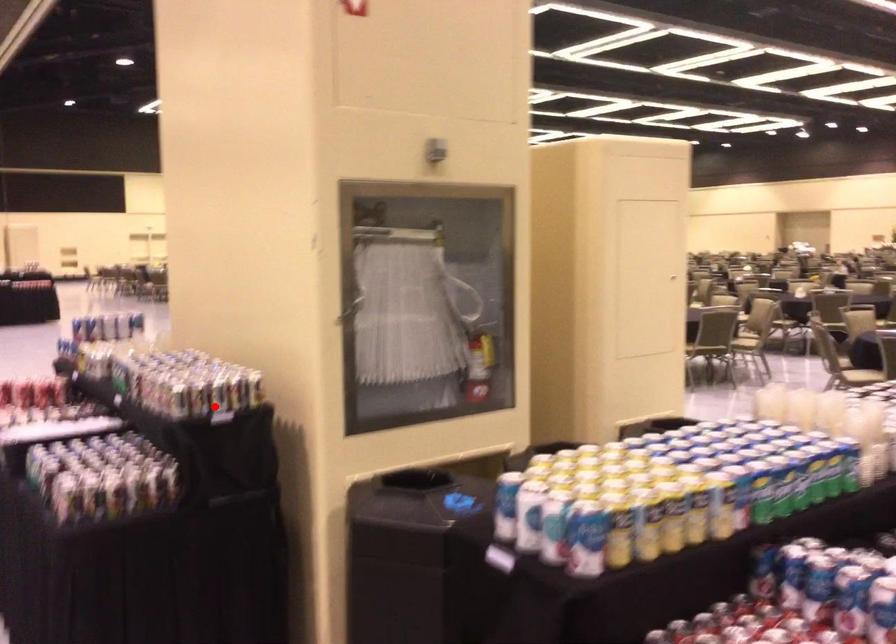
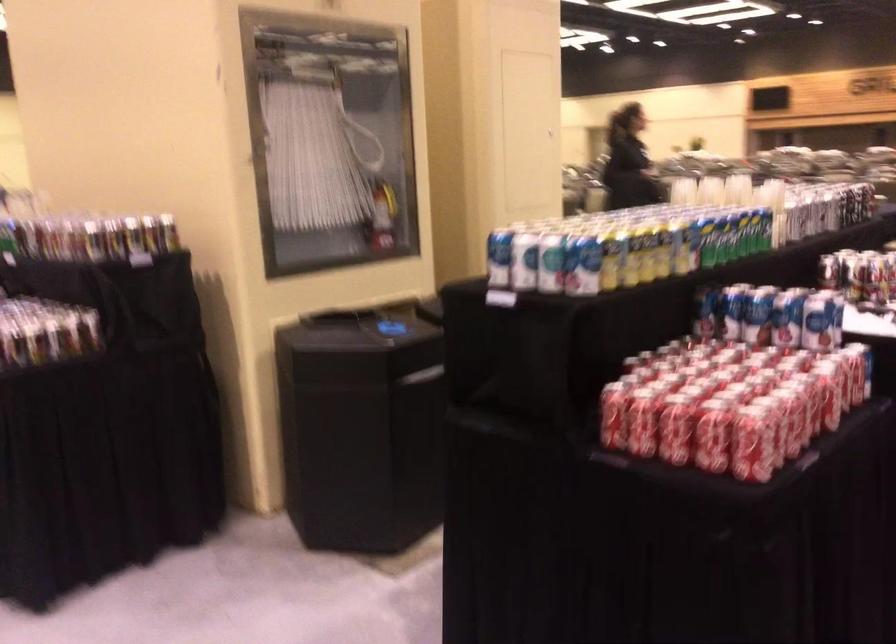
Find the pixel in the second image that matches the highlighted location in the first image.

(131, 254)